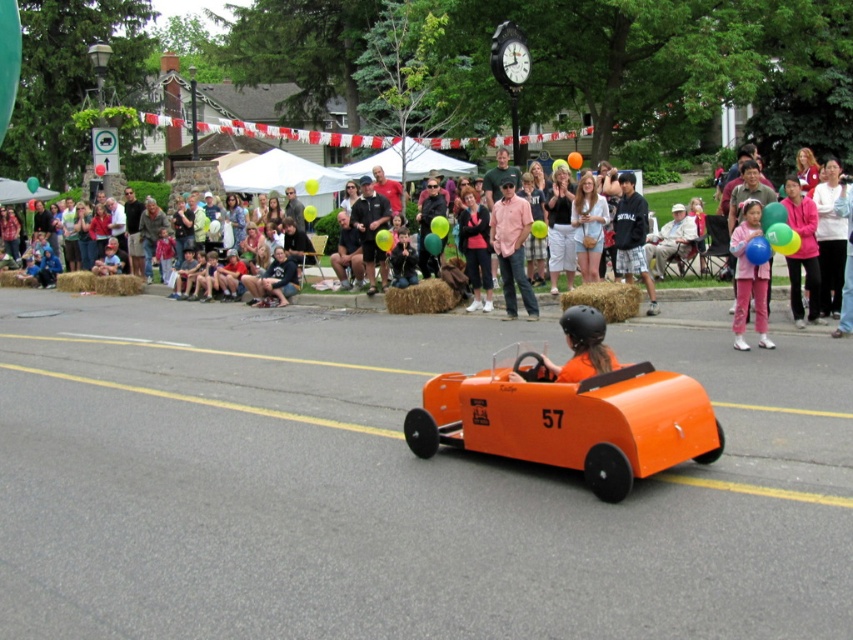
Question: Does pink fabric jacket at right come behind matte pink shirt at center?

Choices:
 (A) no
 (B) yes

Answer: (A)

Question: Which point is closer to the camera?

Choices:
 (A) pos(525,209)
 (B) pos(640,212)

Answer: (B)

Question: Can you confirm if pink cotton shirt at center is bigger than pink fabric jacket at right?

Choices:
 (A) yes
 (B) no

Answer: (B)

Question: Is pink cotton shirt at center positioned at the back of matte pink pants at right?

Choices:
 (A) no
 (B) yes

Answer: (B)

Question: Estimate the real-world distances between objects in this image. Which object is closer to the matte pink pants at right?

Choices:
 (A) orange matte race car at center
 (B) pink fabric jacket at right
 (C) dark gray sweatshirt at center
 (D) matte orange balloons at upper center

Answer: (B)

Question: Among these points, which one is farthest from the camera?

Choices:
 (A) (639, 262)
 (B) (543, 461)

Answer: (A)